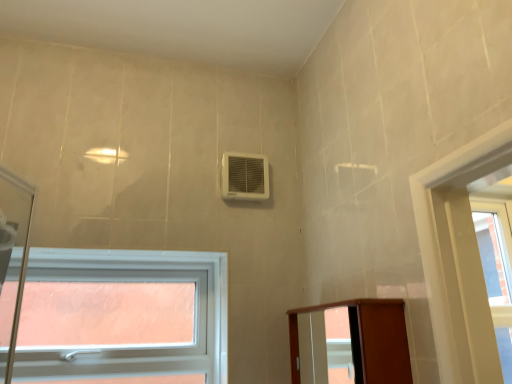
Question: From the image's perspective, is brown wood elevator at lower right located above white plastic window at lower left?

Choices:
 (A) yes
 (B) no

Answer: (A)

Question: Does brown wood elevator at lower right come behind white plastic window at lower left?

Choices:
 (A) no
 (B) yes

Answer: (A)

Question: Can you confirm if brown wood elevator at lower right is bigger than white plastic window at lower left?

Choices:
 (A) yes
 (B) no

Answer: (B)

Question: From a real-world perspective, is brown wood elevator at lower right on top of white plastic window at lower left?

Choices:
 (A) yes
 (B) no

Answer: (B)

Question: Considering the relative positions of brown wood elevator at lower right and white plastic window at lower left in the image provided, is brown wood elevator at lower right to the left of white plastic window at lower left from the viewer's perspective?

Choices:
 (A) yes
 (B) no

Answer: (B)

Question: From the image's perspective, is white plastic air conditioning unit at upper center located above or below white plastic window at lower left?

Choices:
 (A) above
 (B) below

Answer: (A)

Question: In terms of height, does white plastic air conditioning unit at upper center look taller or shorter compared to white plastic window at lower left?

Choices:
 (A) tall
 (B) short

Answer: (B)

Question: Is white plastic air conditioning unit at upper center inside or outside of white plastic window at lower left?

Choices:
 (A) inside
 (B) outside

Answer: (B)

Question: From a real-world perspective, relative to white plastic window at lower left, is white plastic air conditioning unit at upper center vertically above or below?

Choices:
 (A) above
 (B) below

Answer: (A)

Question: Considering the positions of brown wood elevator at lower right and white plastic window at lower left in the image, is brown wood elevator at lower right bigger or smaller than white plastic window at lower left?

Choices:
 (A) small
 (B) big

Answer: (A)

Question: From the image's perspective, is brown wood elevator at lower right above or below white plastic window at lower left?

Choices:
 (A) above
 (B) below

Answer: (A)

Question: Is brown wood elevator at lower right situated inside white plastic window at lower left or outside?

Choices:
 (A) outside
 (B) inside

Answer: (A)

Question: In terms of height, does brown wood elevator at lower right look taller or shorter compared to white plastic window at lower left?

Choices:
 (A) tall
 (B) short

Answer: (B)

Question: Is white plastic window at lower left bigger or smaller than brown wood elevator at lower right?

Choices:
 (A) small
 (B) big

Answer: (B)

Question: Considering the positions of point (119, 276) and point (389, 362), is point (119, 276) closer or farther from the camera than point (389, 362)?

Choices:
 (A) closer
 (B) farther

Answer: (B)